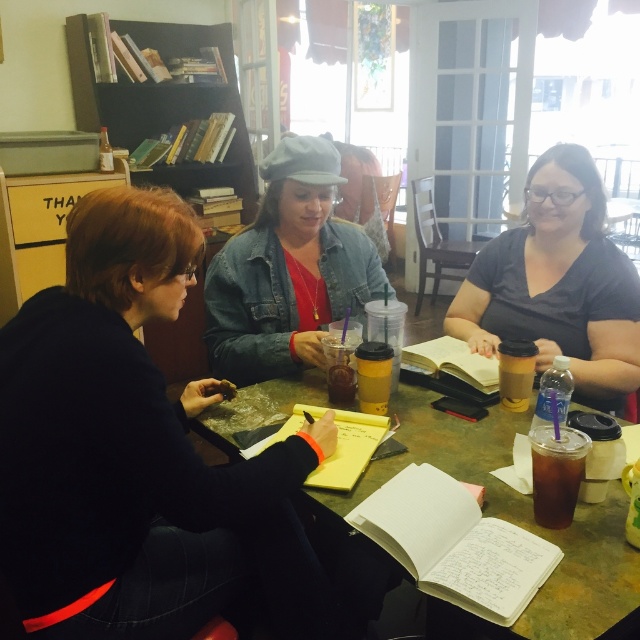
From the picture: You are a photographer trying to capture a closeup of the dark gray matte shirt at center and the dark brown glass at lower right. Since you want to focus on the shirt first, which object should you adjust your camera lens to focus on first, and why?

You should focus on the dark gray matte shirt at center first because it is above the dark brown glass at lower right, making it closer to the camera lens.

You are standing at the center of the table and want to reach both the point at coordinates point (556, 150) and point (544, 460). Which point will you reach first?

The point at coordinates point (556, 150) is closer to you than point (544, 460), so you will reach it first.